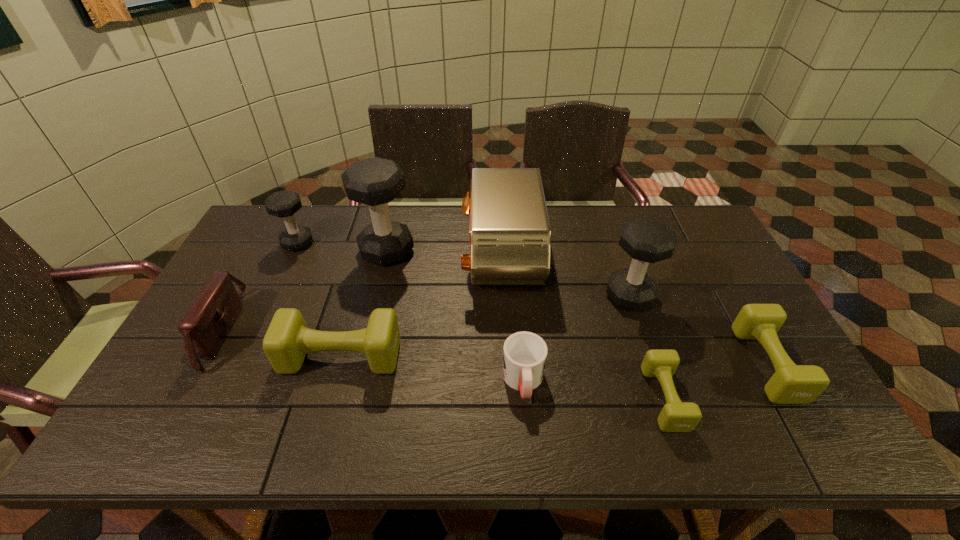
The height and width of the screenshot is (540, 960). What are the coordinates of `olive dumbbell that stands as the third closest to the tallest dumbbell` in the screenshot? It's located at (790, 384).

Find the location of a particular element. The image size is (960, 540). vacant space that satisfies the following two spatial constraints: 1. on the front flap of the rightmost object; 2. on the right side of the shoulder bag is located at coordinates pos(198,364).

This screenshot has height=540, width=960. Identify the location of free space that satisfies the following two spatial constraints: 1. on the front flap of the shoulder bag; 2. on the back side of the shortest object. (180, 398).